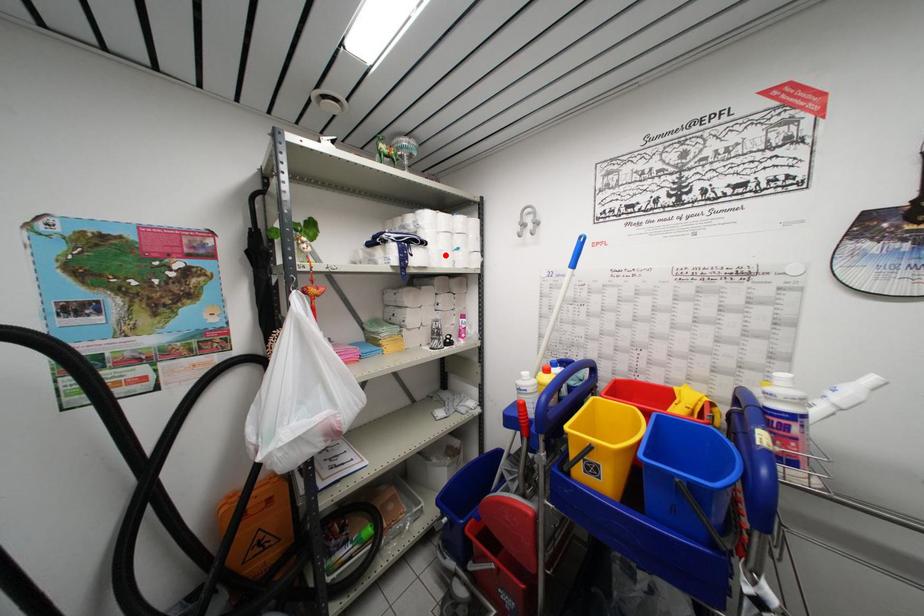
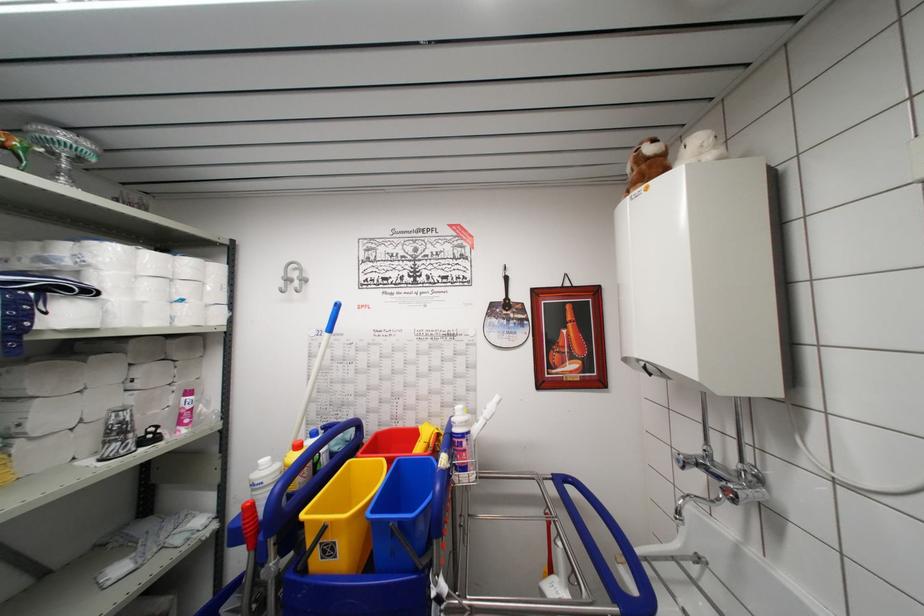
Find the pixel in the second image that matches the highlighted location in the first image.

(149, 307)